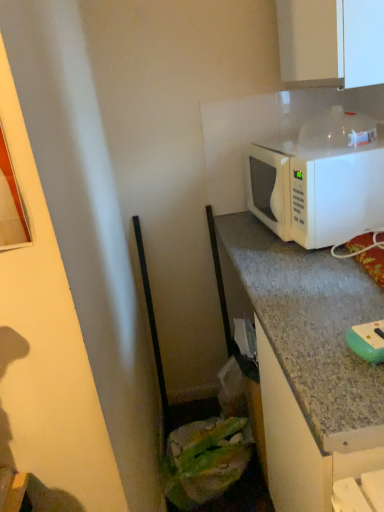
Question: From the image's perspective, is white matte microwave at upper right located above or below white glossy cabinet at upper right?

Choices:
 (A) above
 (B) below

Answer: (B)

Question: Is point (311, 156) positioned closer to the camera than point (276, 6)?

Choices:
 (A) farther
 (B) closer

Answer: (B)

Question: Estimate the real-world distances between objects in this image. Which object is farther from the white glossy cabinet at upper right?

Choices:
 (A) green rubber sponge at lower right
 (B) white matte microwave at upper right

Answer: (A)

Question: Which object is the farthest from the white matte microwave at upper right?

Choices:
 (A) green rubber sponge at lower right
 (B) white glossy cabinet at upper right

Answer: (A)